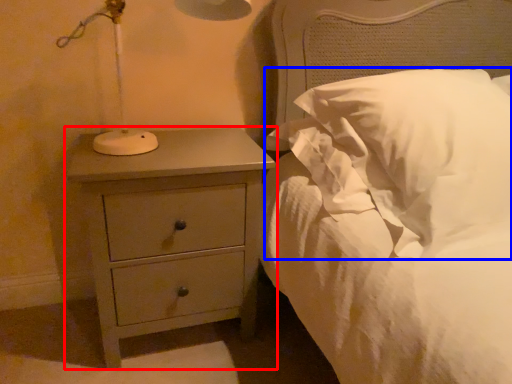
Question: Among these objects, which one is nearest to the camera, chest of drawers (highlighted by a red box) or pillow (highlighted by a blue box)?

Choices:
 (A) chest of drawers
 (B) pillow

Answer: (B)